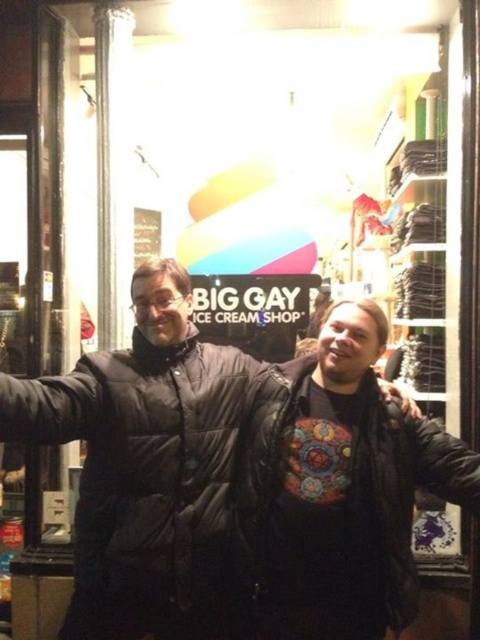
You are a photographer trying to capture both the black puffy jacket at center and the leather jacket at center in a single frame. Given that your camera has a maximum focus range of 25 inches, will you be able to focus on both jackets simultaneously?

The black puffy jacket at center is 25.18 inches away from the leather jacket at center. Since the distance between them exceeds the camera maximum focus range of 25 inches, you cannot focus on both jackets simultaneously.

You are a photographer trying to capture both the black puffy jacket at center and the leather jacket at center in a single frame. Based on their positions, which jacket is closer to the camera?

The black puffy jacket at center is located above the leather jacket at center, so it is closer to the camera.